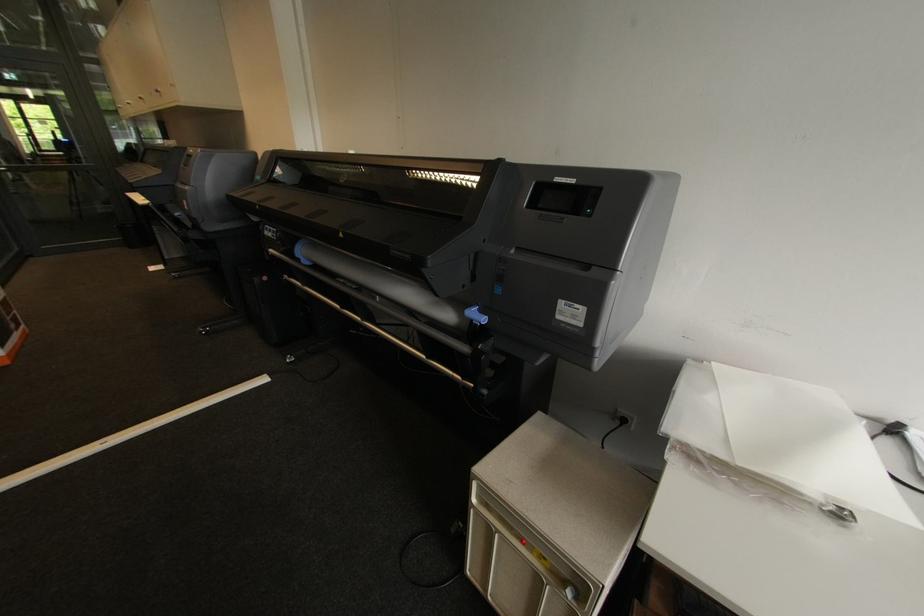
Find where to lift the white rod. Please return your answer as a coordinate pair (x, y).

(127, 434)